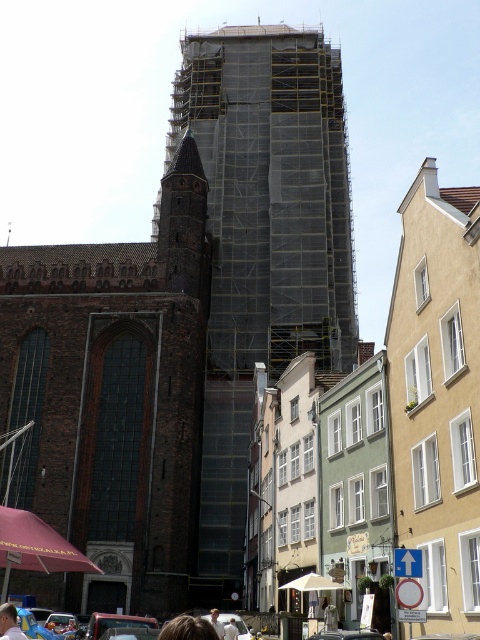
Based on the photo, does light brown hair at lower center appear under light blue shirt at lower left?

Yes.

Between point (196, 632) and point (7, 604), which one is positioned in front?

Point (196, 632) is in front.

Between point (192, 636) and point (14, 636), which one is positioned behind?

Positioned behind is point (14, 636).

You are a GUI agent. You are given a task and a screenshot of the screen. Output one action in this format:
    pyautogui.click(x=<x>, y=<y>)
    Task: Click on the light brown hair at lower center
    
    Given the screenshot: What is the action you would take?
    pyautogui.click(x=188, y=628)

In the scene shown: Which is above, dark gray scaffolding at center or light blue shirt at lower left?

dark gray scaffolding at center is higher up.

Is dark gray scaffolding at center to the right of light blue shirt at lower left from the viewer's perspective?

Correct, you'll find dark gray scaffolding at center to the right of light blue shirt at lower left.

Find the location of a particular element. dark gray scaffolding at center is located at coordinates (271, 193).

Is dark gray scaffolding at center further to camera compared to light brown hair at lower center?

That is True.

Does dark gray scaffolding at center appear on the right side of light brown hair at lower center?

Indeed, dark gray scaffolding at center is positioned on the right side of light brown hair at lower center.

Is point (254, 150) positioned in front of point (205, 621)?

No, (254, 150) is behind (205, 621).

Locate an element on the screen. dark gray scaffolding at center is located at coordinates tap(271, 193).